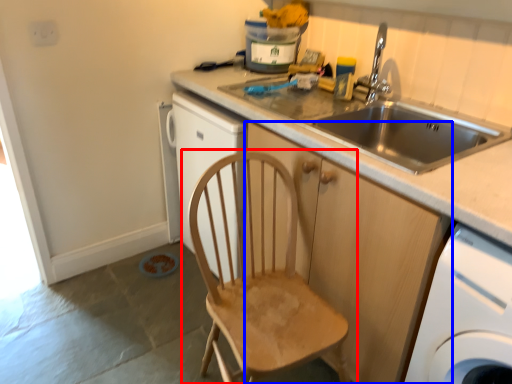
Question: Which of the following is the farthest to the observer, chair (highlighted by a red box) or cabinetry (highlighted by a blue box)?

Choices:
 (A) chair
 (B) cabinetry

Answer: (B)